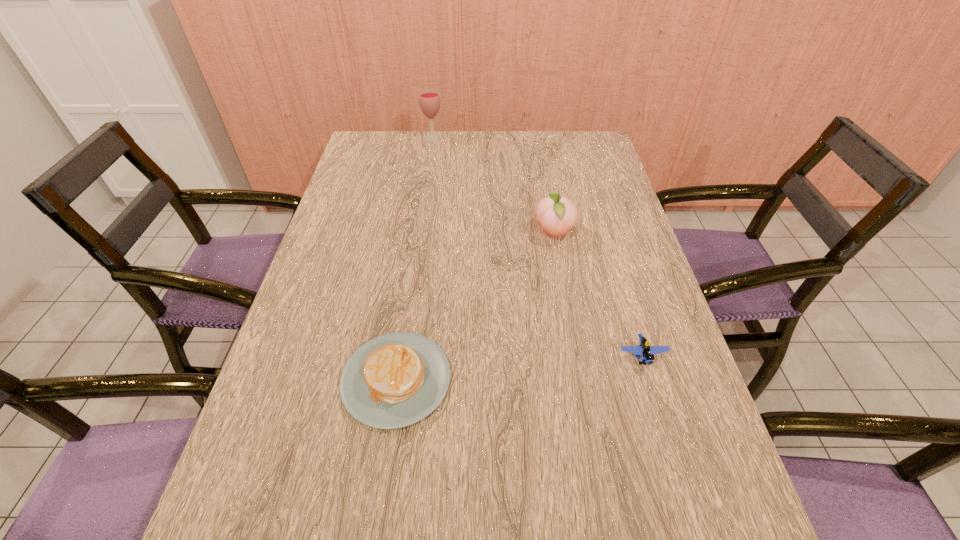
The image size is (960, 540). I want to click on object that is positioned at the far edge, so click(x=429, y=100).

I want to click on object located at the left edge, so click(x=394, y=380).

Identify the location of object that is at the right edge. pyautogui.click(x=644, y=350).

This screenshot has width=960, height=540. I want to click on free space at the far edge, so click(x=488, y=166).

This screenshot has height=540, width=960. Identify the location of free location at the left edge. (284, 475).

At what (x,y) coordinates should I click in order to perform the action: click on blank area at the right edge. Please return your answer as a coordinate pair (x, y). This screenshot has width=960, height=540. Looking at the image, I should click on (641, 266).

In the image, there is a desktop. Where is `vacant space at the far left corner`? Image resolution: width=960 pixels, height=540 pixels. vacant space at the far left corner is located at coordinates (371, 147).

I want to click on empty space that is in between the peach and the wineglass, so click(x=493, y=186).

Image resolution: width=960 pixels, height=540 pixels. I want to click on free space that is in between the tallest object and the pancake, so click(415, 259).

Locate an element on the screen. This screenshot has width=960, height=540. free space between the tallest object and the Lego is located at coordinates (538, 247).